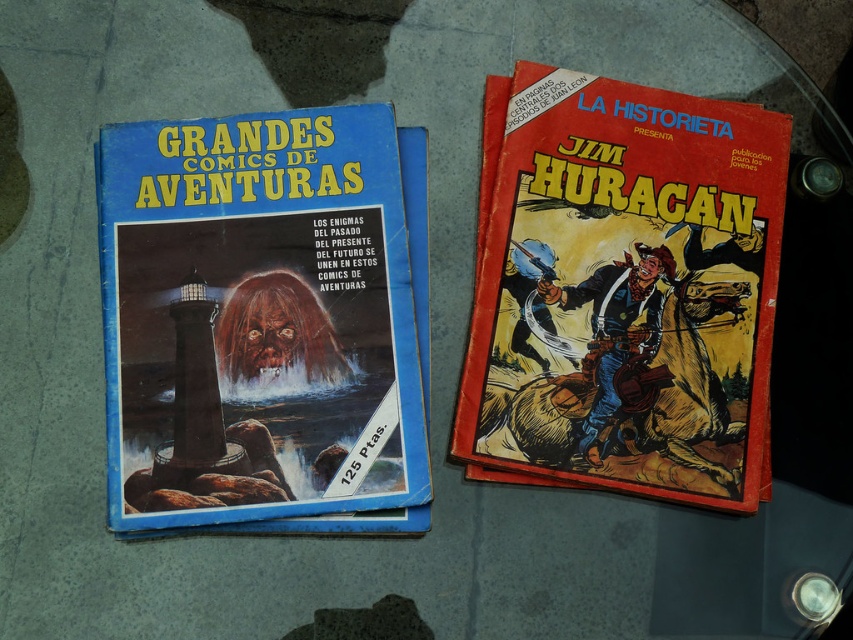
Question: Does blue paper comic book at left have a lesser width compared to red matte comic book at right?

Choices:
 (A) no
 (B) yes

Answer: (B)

Question: Which point is farther from the camera taking this photo?

Choices:
 (A) (317, 413)
 (B) (548, 410)

Answer: (B)

Question: Is blue paper comic book at left above red matte comic book at right?

Choices:
 (A) yes
 (B) no

Answer: (B)

Question: Which point is farther to the camera?

Choices:
 (A) red matte comic book at right
 (B) blue paper comic book at left

Answer: (A)

Question: Among these objects, which one is nearest to the camera?

Choices:
 (A) red matte comic book at right
 (B) blue paper comic book at left

Answer: (B)

Question: Does blue paper comic book at left appear on the left side of red matte comic book at right?

Choices:
 (A) yes
 (B) no

Answer: (A)